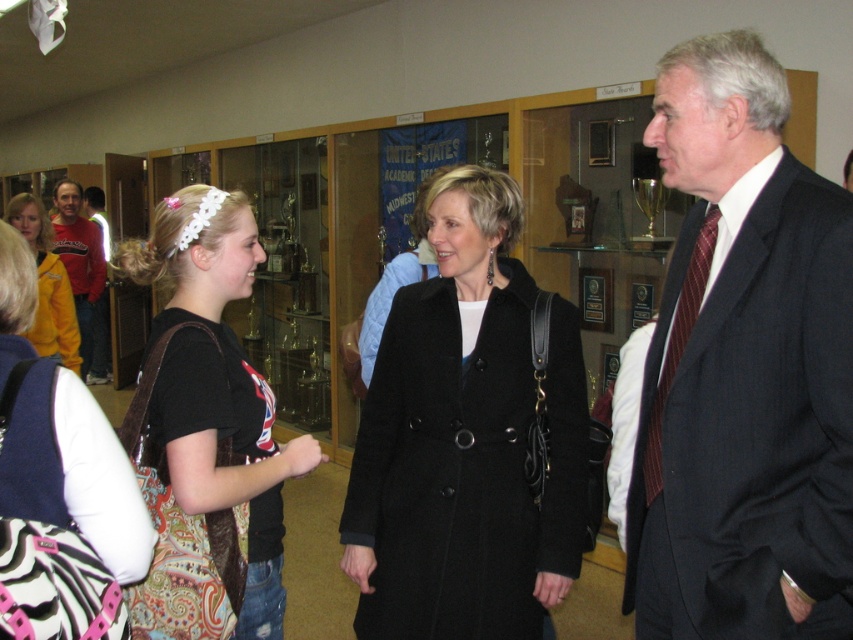
Question: Which point is closer to the camera?

Choices:
 (A) matte yellow jacket at left
 (B) zebra-patterned backpack at lower left

Answer: (B)

Question: Considering the real-world distances, which object is closest to the matte yellow jacket at left?

Choices:
 (A) black cotton shirt at center
 (B) dark gray suit at center
 (C) black wool coat at center

Answer: (A)

Question: Can you confirm if black wool coat at center is wider than black cotton shirt at center?

Choices:
 (A) no
 (B) yes

Answer: (B)

Question: Estimate the real-world distances between objects in this image. Which object is farther from the black cotton shirt at center?

Choices:
 (A) black wool coat at center
 (B) maroon striped tie at right
 (C) dark gray suit at center

Answer: (C)

Question: Does zebra-patterned backpack at lower left appear over matte yellow jacket at left?

Choices:
 (A) yes
 (B) no

Answer: (B)

Question: In this image, where is black wool coat at center located relative to zebra-patterned backpack at lower left?

Choices:
 (A) above
 (B) below

Answer: (B)